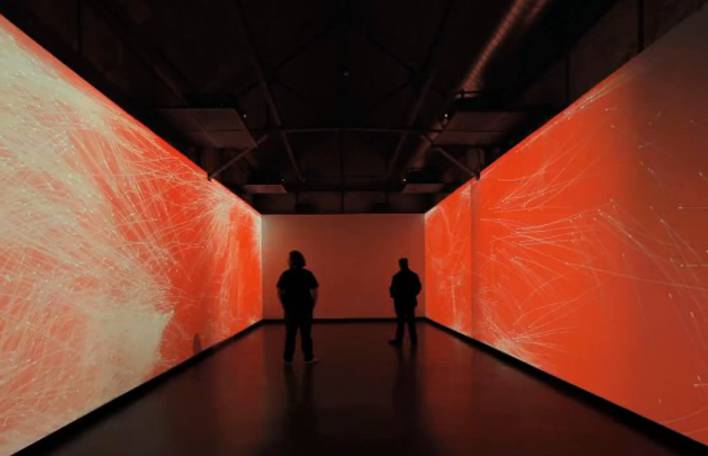
Find the location of a particular element. The height and width of the screenshot is (456, 708). air duct is located at coordinates (485, 71).